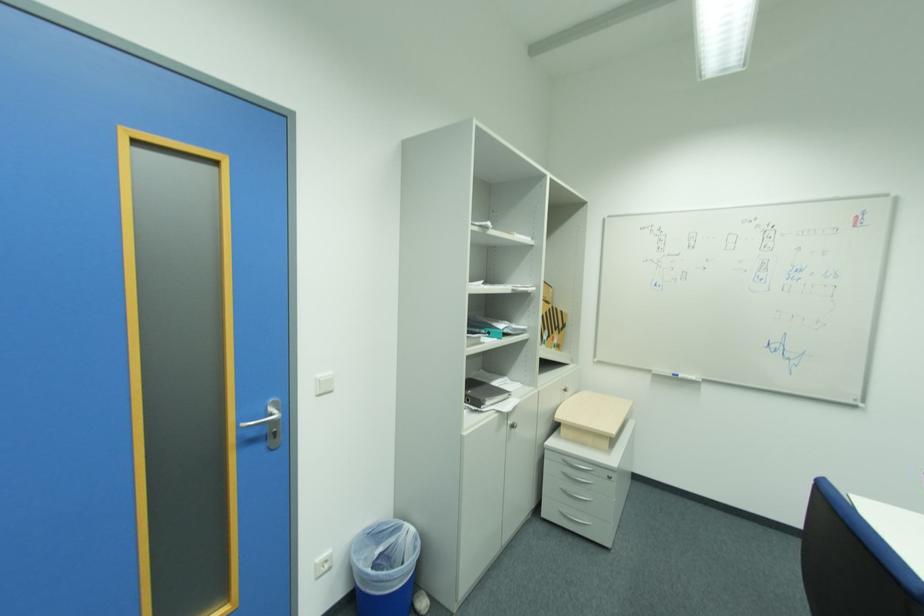
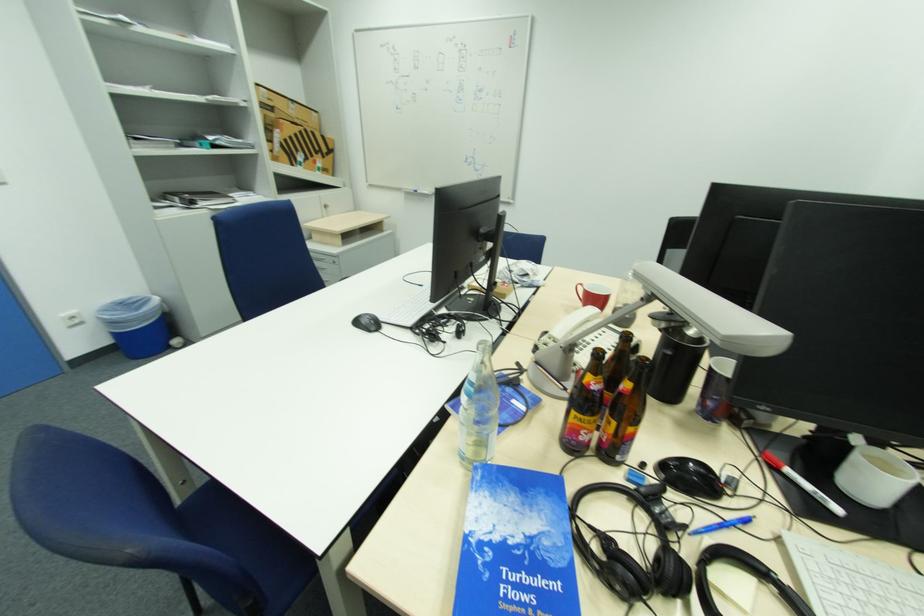
The images are taken continuously from a first-person perspective. In which direction are you moving?

The movement direction of the cameraman is right, backward.